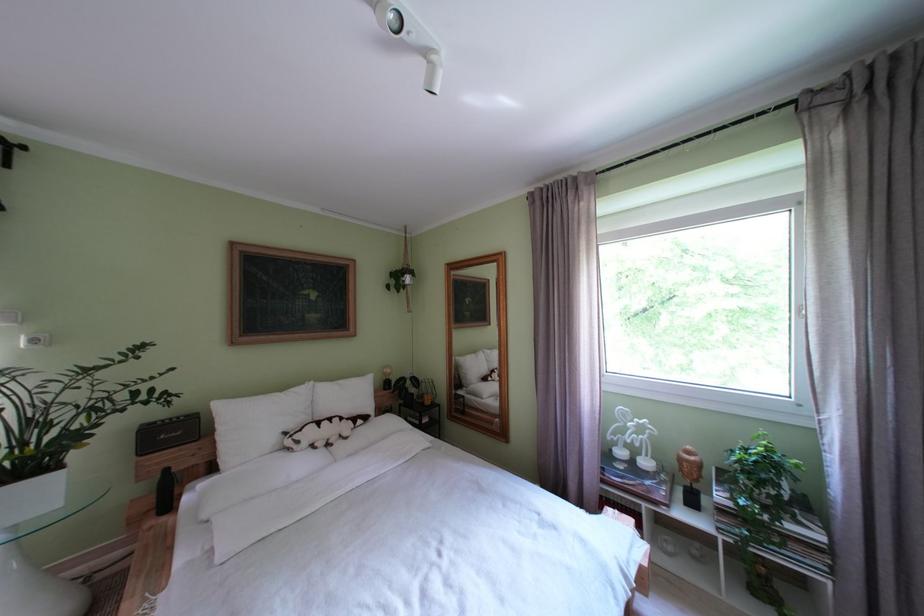
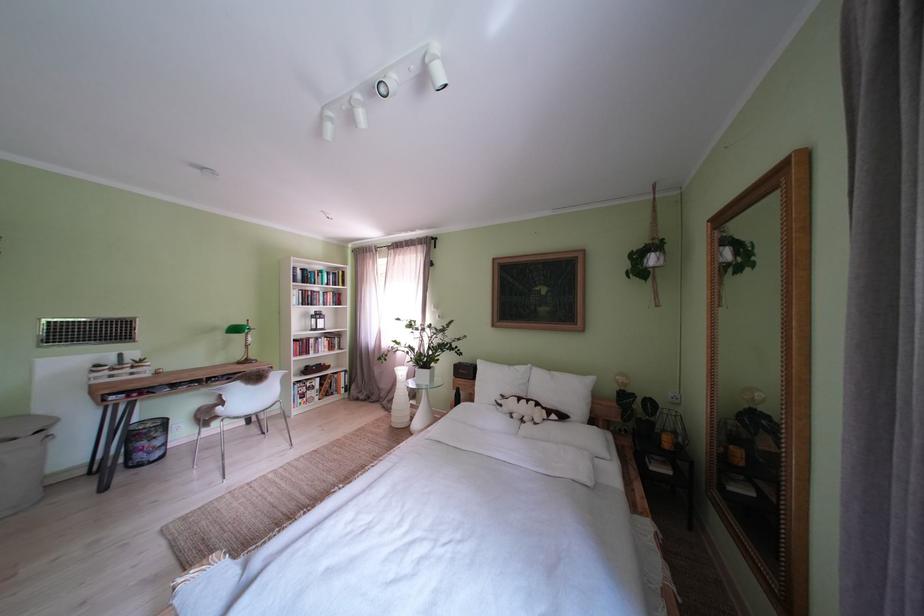
Find the pixel in the second image that matches the point at 310,447 in the first image.

(512, 411)